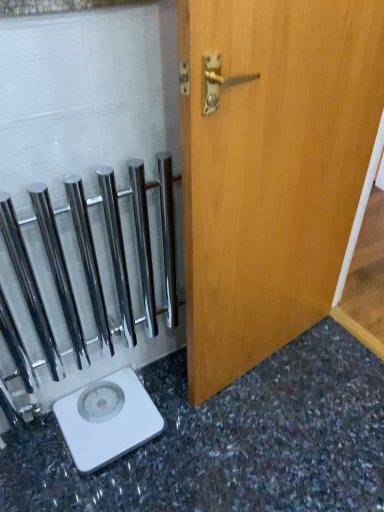
I want to click on free spot in front of light brown wood door at center, so click(260, 433).